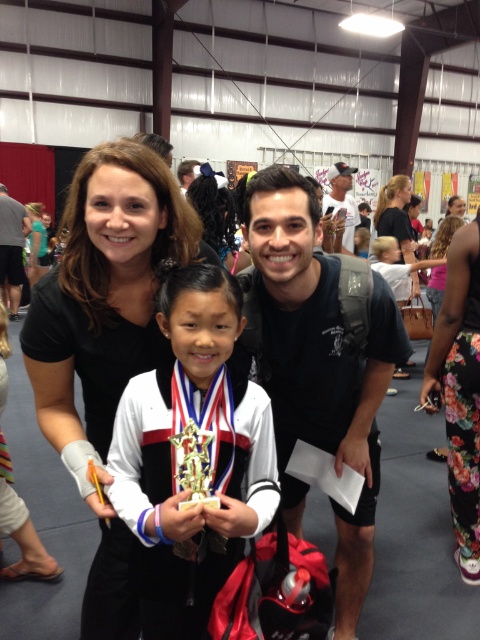
Which is above, floral fabric pants at lower right or matte black shirt at upper right?

Positioned higher is matte black shirt at upper right.

Who is more distant from viewer, (421, 385) or (397, 378)?

→ The point (397, 378) is more distant.

Identify the location of floral fabric pants at lower right. Image resolution: width=480 pixels, height=640 pixels. (459, 392).

Between black matte shirt at upper left and floral fabric pants at lower right, which one appears on the right side from the viewer's perspective?

floral fabric pants at lower right is more to the right.

What do you see at coordinates (106, 337) in the screenshot? I see `black matte shirt at upper left` at bounding box center [106, 337].

Does point (84, 273) lie in front of point (455, 292)?

Yes, point (84, 273) is closer to viewer.

Image resolution: width=480 pixels, height=640 pixels. Identify the location of black matte shirt at upper left. (106, 337).

What are the coordinates of `black matte shirt at upper left` in the screenshot? It's located at (106, 337).

Between black matte shirt at upper left and white matte/soft fabric at center, which one has less height?

With less height is white matte/soft fabric at center.

Who is more distant from viewer, (44, 326) or (28, 541)?

The point (28, 541) is behind.

What are the coordinates of `black matte shirt at upper left` in the screenshot? It's located at (106, 337).